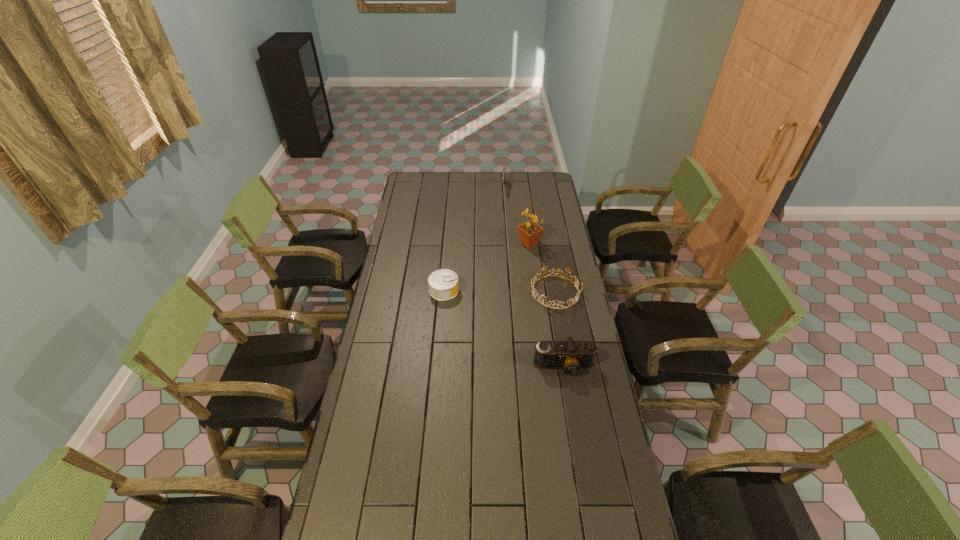
In order to click on vacant space on the desktop that is between the leftmost object and the camera and is positioned at the barrel of the farthest object in this screenshot , I will do (x=489, y=319).

Find the location of a particular element. Image resolution: width=960 pixels, height=540 pixels. vacant space on the desktop that is between the leftmost object and the nearest object and is positioned on the front-facing side of the tiara is located at coordinates (516, 336).

Locate an element on the screen. vacant space on the desktop that is between the leftmost object and the nearest object and is positioned at the front of the tallest object with flowers visible is located at coordinates (516, 336).